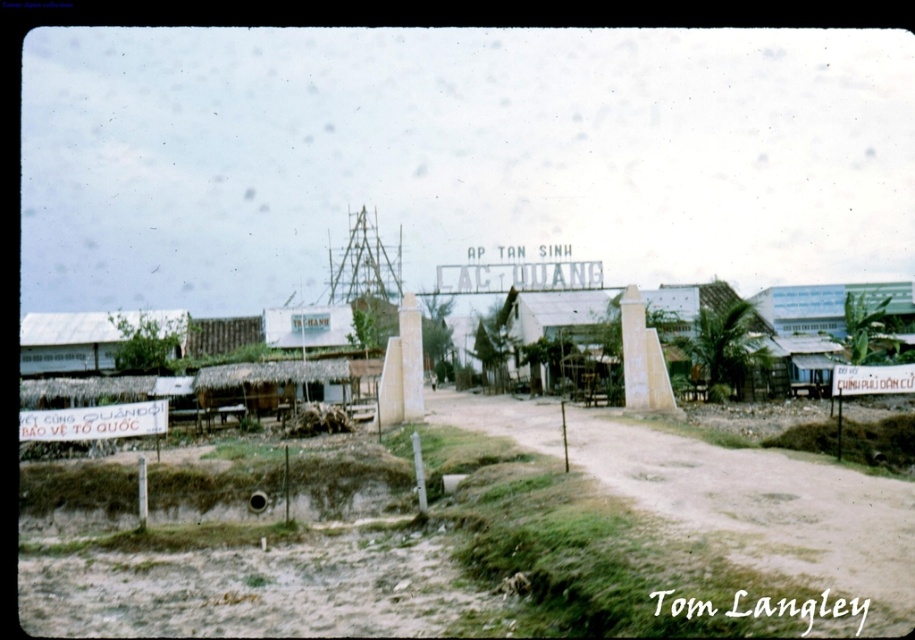
Is point (752, 456) in front of point (106, 326)?

Yes, it is.

The image size is (915, 640). What do you see at coordinates (760, 504) in the screenshot? I see `brown sandy dirt track at center` at bounding box center [760, 504].

This screenshot has width=915, height=640. What are the coordinates of `brown sandy dirt track at center` in the screenshot? It's located at (760, 504).

At what (x,y) coordinates should I click in order to perform the action: click on brown sandy dirt track at center. Please return your answer as a coordinate pair (x, y). Looking at the image, I should click on (760, 504).

Does green grassy field at lower left have a lesser width compared to brown sandy dirt track at center?

In fact, green grassy field at lower left might be wider than brown sandy dirt track at center.

What do you see at coordinates (471, 532) in the screenshot?
I see `green grassy field at lower left` at bounding box center [471, 532].

The image size is (915, 640). Describe the element at coordinates (471, 532) in the screenshot. I see `green grassy field at lower left` at that location.

The image size is (915, 640). In order to click on green grassy field at lower left in this screenshot , I will do `click(471, 532)`.

Who is taller, green grassy field at lower left or white corrugated metal hut at lower left?

Standing taller between the two is white corrugated metal hut at lower left.

Who is more distant from viewer, (677, 451) or (38, 339)?

The point (38, 339) is behind.

Describe the element at coordinates (471, 532) in the screenshot. I see `green grassy field at lower left` at that location.

Find the location of a particular element. The width and height of the screenshot is (915, 640). green grassy field at lower left is located at coordinates [471, 532].